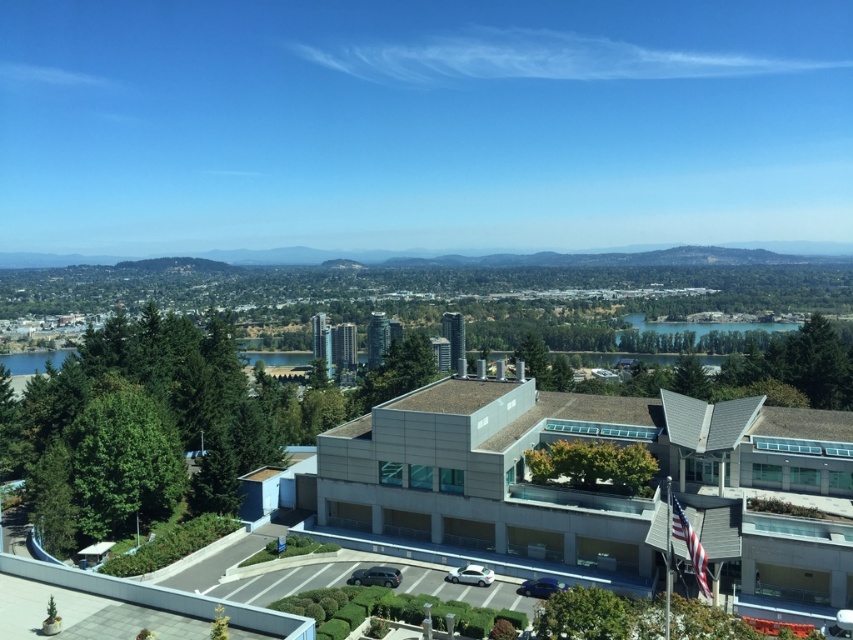
Locate an element on the screen. The image size is (853, 640). shiny black suv at center is located at coordinates (375, 577).

Does shiny black suv at center lie in front of glossy blue car at lower center?

No, it is not.

Does point (386, 586) come closer to viewer compared to point (537, 584)?

That is False.

You are a GUI agent. You are given a task and a screenshot of the screen. Output one action in this format:
    pyautogui.click(x=<x>, y=<y>)
    Task: Click on the shiny black suv at center
    
    Given the screenshot: What is the action you would take?
    pyautogui.click(x=375, y=577)

Is blue glassy lake at center below shiny black suv at center?

Actually, blue glassy lake at center is above shiny black suv at center.

Does blue glassy lake at center have a smaller size compared to shiny black suv at center?

No.

Between point (744, 321) and point (372, 572), which one is positioned behind?

Point (744, 321)

Image resolution: width=853 pixels, height=640 pixels. Identify the location of blue glassy lake at center. (705, 324).

Which of these two, blue glassy lake at center or glossy blue car at lower center, stands shorter?

glossy blue car at lower center

Does blue glassy lake at center appear under glossy blue car at lower center?

No.

Is point (717, 323) farther from viewer compared to point (525, 593)?

That is True.

You are a GUI agent. You are given a task and a screenshot of the screen. Output one action in this format:
    pyautogui.click(x=<x>, y=<y>)
    Task: Click on the blue glassy lake at center
    
    Given the screenshot: What is the action you would take?
    pyautogui.click(x=705, y=324)